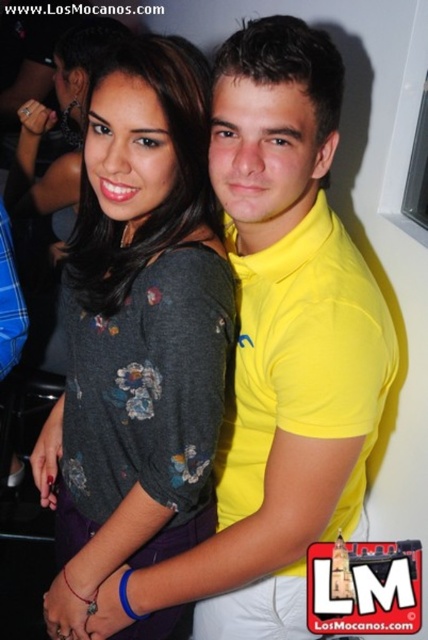
Question: Which point appears farthest from the camera in this image?

Choices:
 (A) pyautogui.click(x=315, y=128)
 (B) pyautogui.click(x=162, y=259)

Answer: (B)

Question: Which object is farther from the camera taking this photo?

Choices:
 (A) yellow cotton polo shirt at center
 (B) dark gray floral shirt at center

Answer: (B)

Question: Can you confirm if yellow cotton polo shirt at center is thinner than dark gray floral shirt at center?

Choices:
 (A) yes
 (B) no

Answer: (B)

Question: Is yellow cotton polo shirt at center positioned before dark gray floral shirt at center?

Choices:
 (A) no
 (B) yes

Answer: (B)

Question: Does yellow cotton polo shirt at center have a larger size compared to dark gray floral shirt at center?

Choices:
 (A) yes
 (B) no

Answer: (A)

Question: Among these objects, which one is nearest to the camera?

Choices:
 (A) dark gray floral shirt at center
 (B) yellow cotton polo shirt at center

Answer: (B)